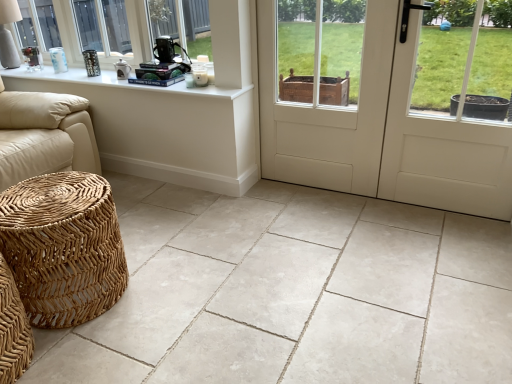
Find the location of a particular element. Image resolution: width=512 pixels, height=384 pixels. free space that is to the left of white matte door at center is located at coordinates (288, 217).